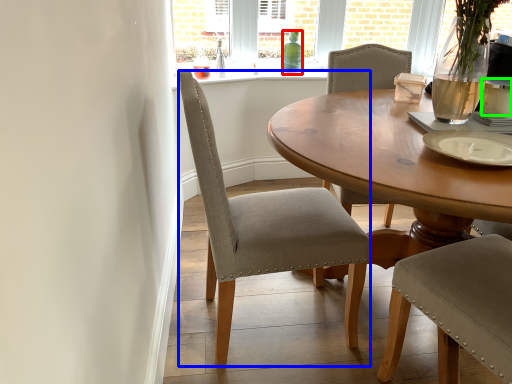
Question: Considering the real-world distances, which object is closest to bottle (highlighted by a red box)? chair (highlighted by a blue box) or coffee cup (highlighted by a green box).

Choices:
 (A) chair
 (B) coffee cup

Answer: (B)